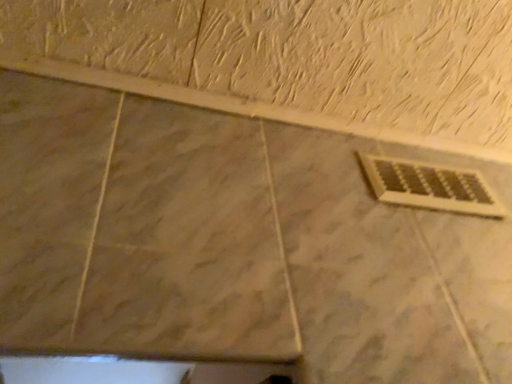
Image resolution: width=512 pixels, height=384 pixels. What do you see at coordinates (430, 186) in the screenshot?
I see `white plastic vent at lower right` at bounding box center [430, 186].

What is the approximate height of white plastic vent at lower right?

white plastic vent at lower right is 5.22 inches in height.

Locate an element on the screen. Image resolution: width=512 pixels, height=384 pixels. white plastic vent at lower right is located at coordinates (430, 186).

Find the location of `white plastic vent at lower right`. white plastic vent at lower right is located at coordinates (430, 186).